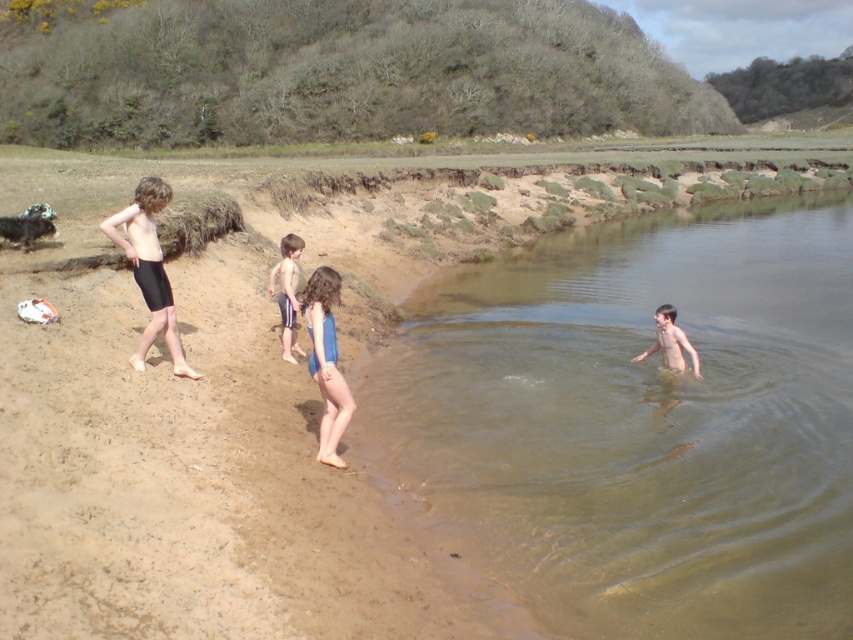
You are a photographer standing on the beach. You want to take a photo that includes both the blue fabric shorts at center and the light brown skin at water right. Which object should you focus on first to ensure both are in clear view?

You should focus on the blue fabric shorts at center first because it is closer to the viewer than the light brown skin at water right. By focusing on the closer object, the farther one will still be in focus due to the depth of field.

You are a photographer trying to capture the children on the beach. You want to position yourself so that the blue fabric shorts at center and the light brown skin at water right are both visible in your shot. Based on their positions, which object should be placed closer to the left side of the frame?

The blue fabric shorts at center should be placed closer to the left side of the frame because it is positioned to the left of the light brown skin at water right.